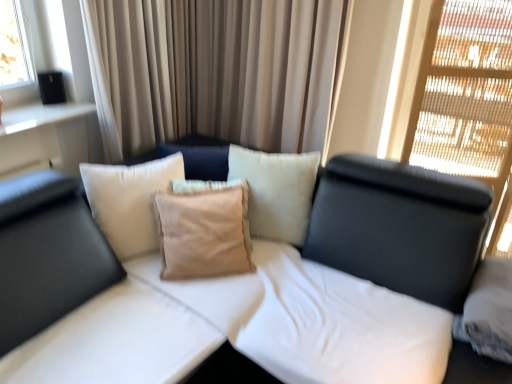
Question: Do you think white fabric studio couch at center is within suede beige pillow at center, or outside of it?

Choices:
 (A) outside
 (B) inside

Answer: (A)

Question: From a real-world perspective, is white fabric studio couch at center physically located above or below suede beige pillow at center?

Choices:
 (A) below
 (B) above

Answer: (A)

Question: Which of these objects is positioned farthest from the translucent wood screen at upper right?

Choices:
 (A) white fabric studio couch at center
 (B) suede beige pillow at center
 (C) satin beige curtain at center

Answer: (B)

Question: Estimate the real-world distances between objects in this image. Which object is farther from the satin beige curtain at center?

Choices:
 (A) suede beige pillow at center
 (B) translucent wood screen at upper right
 (C) white fabric studio couch at center

Answer: (B)